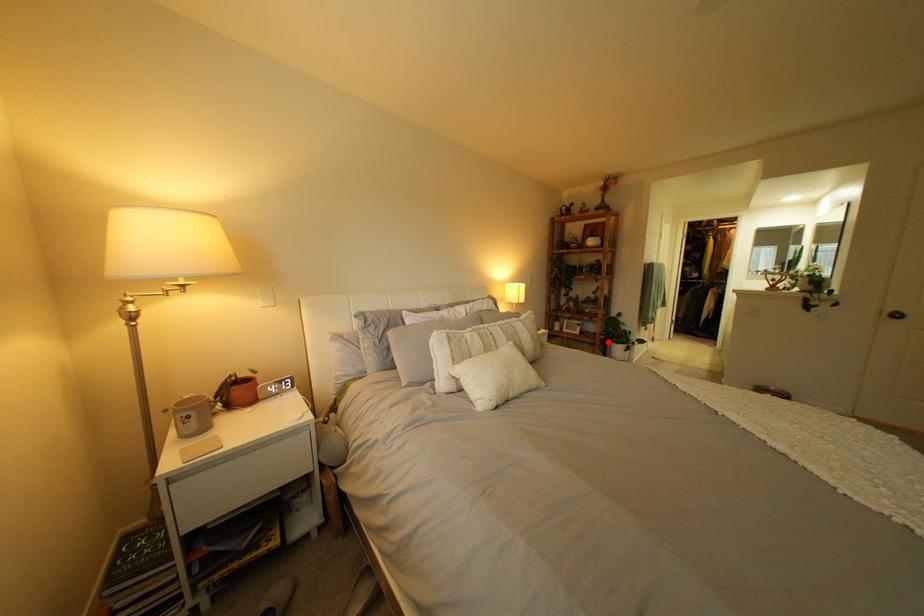
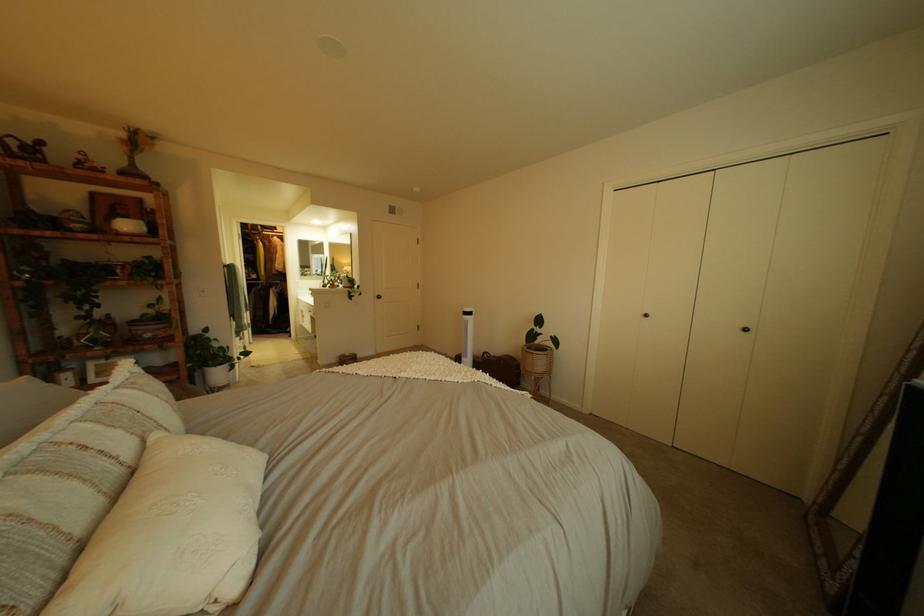
Question: I am providing you with two images of the same scene from different viewpoints. Image1 has a red point marked. In image2, the corresponding 3D location appears at what relative position? Reply with the corresponding letter.

Choices:
 (A) Closer
 (B) Farther

Answer: (A)